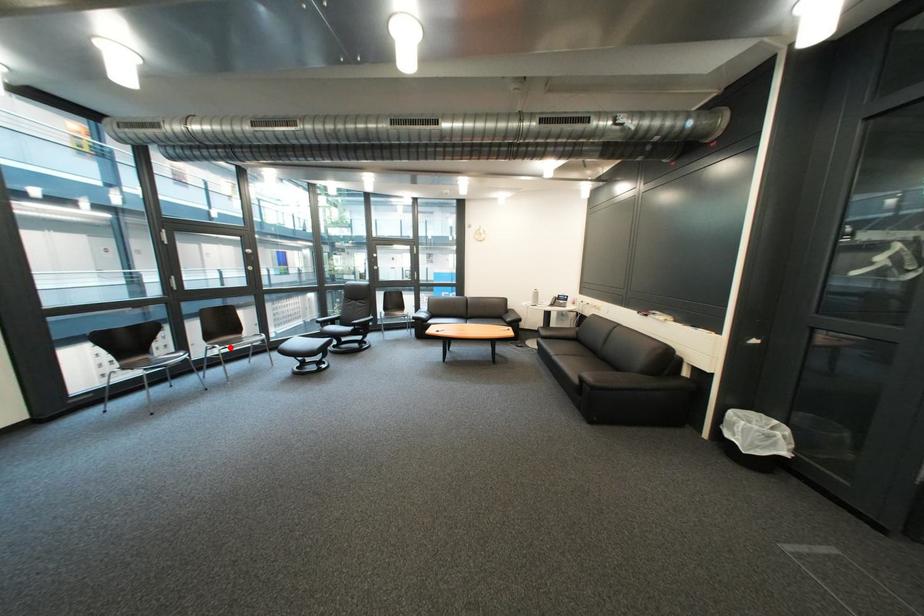
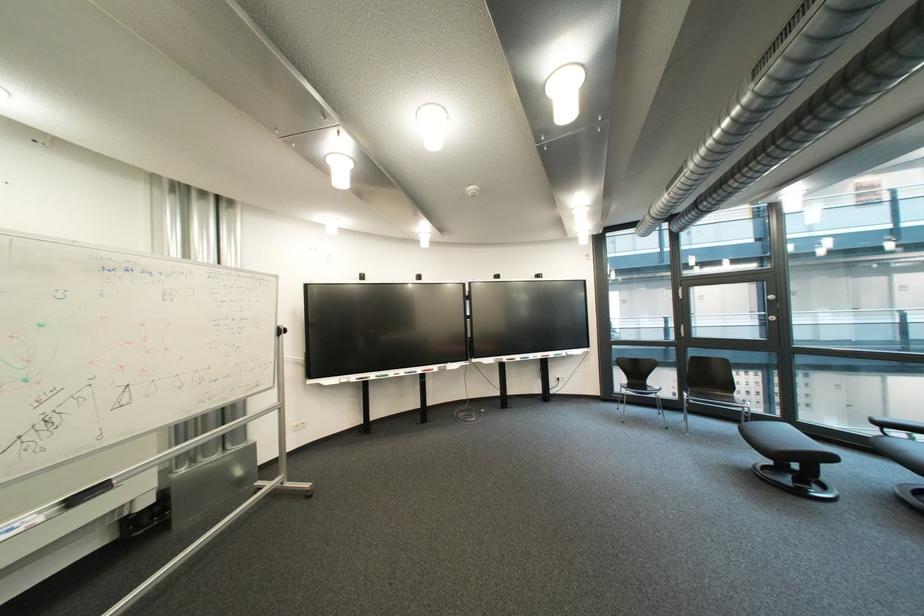
In the second image, find the point that corresponds to the highlighted location in the first image.

(699, 395)